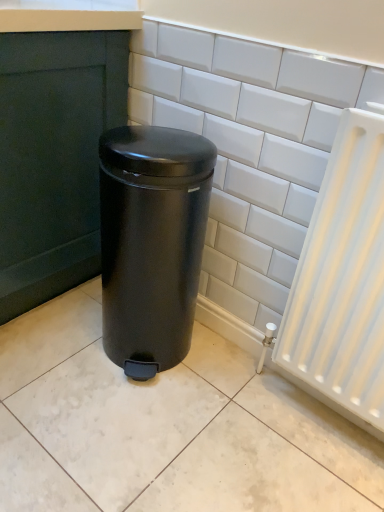
At what (x,y) coordinates should I click in order to perform the action: click on vacant area on top of white glossy tile at center (from a real-world perspective). Please return your answer as a coordinate pair (x, y). The width and height of the screenshot is (384, 512). Looking at the image, I should click on (260, 22).